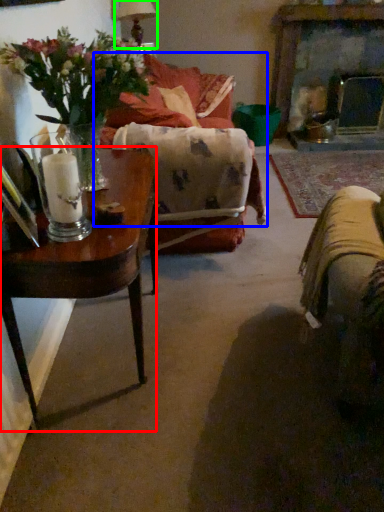
Question: Which is farther away from table (highlighted by a red box)? couch (highlighted by a blue box) or lamp (highlighted by a green box)?

Choices:
 (A) couch
 (B) lamp

Answer: (B)